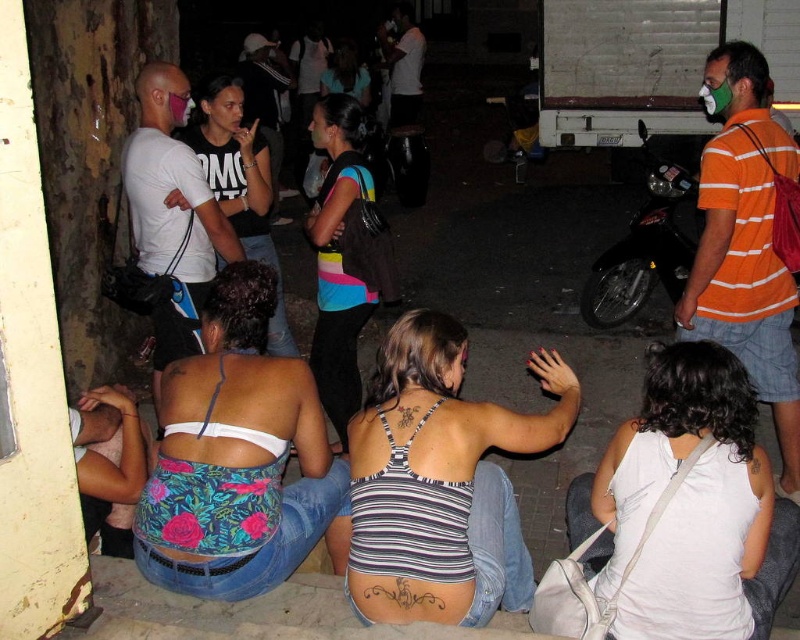
Question: Where is white fabric tank top at lower right located in relation to matte black tank top at upper left in the image?

Choices:
 (A) below
 (B) above

Answer: (A)

Question: Based on their relative distances, which object is nearer to the matte black tank top at upper left?

Choices:
 (A) white fabric tank top at lower right
 (B) striped fabric top at center

Answer: (B)

Question: Among these objects, which one is farthest from the camera?

Choices:
 (A) white fabric tank top at lower right
 (B) striped fabric top at center

Answer: (B)

Question: Considering the relative positions of striped fabric tank top at center and white fabric tank top at lower right in the image provided, where is striped fabric tank top at center located with respect to white fabric tank top at lower right?

Choices:
 (A) right
 (B) left

Answer: (B)

Question: In this image, where is striped fabric tank top at center located relative to matte black tank top at upper left?

Choices:
 (A) right
 (B) left

Answer: (A)

Question: Which object appears farthest from the camera in this image?

Choices:
 (A) matte black tank top at upper left
 (B) striped fabric top at center
 (C) white fabric tank top at lower right

Answer: (B)